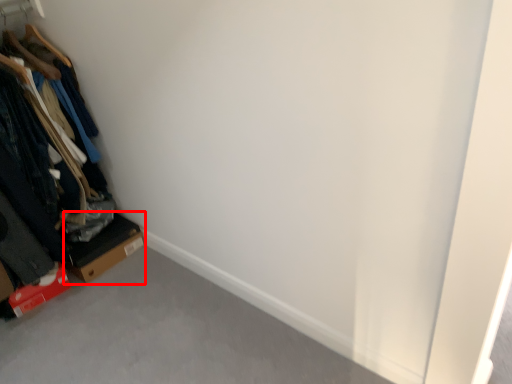
Question: Observing the image, what is the correct spatial positioning of cardboard box (annotated by the red box) in reference to furniture?

Choices:
 (A) right
 (B) left

Answer: (A)